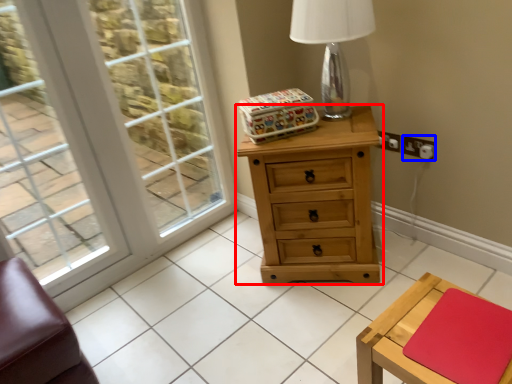
Question: Which point is closer to the camera, chest of drawers (highlighted by a red box) or electric outlet (highlighted by a blue box)?

Choices:
 (A) chest of drawers
 (B) electric outlet

Answer: (A)